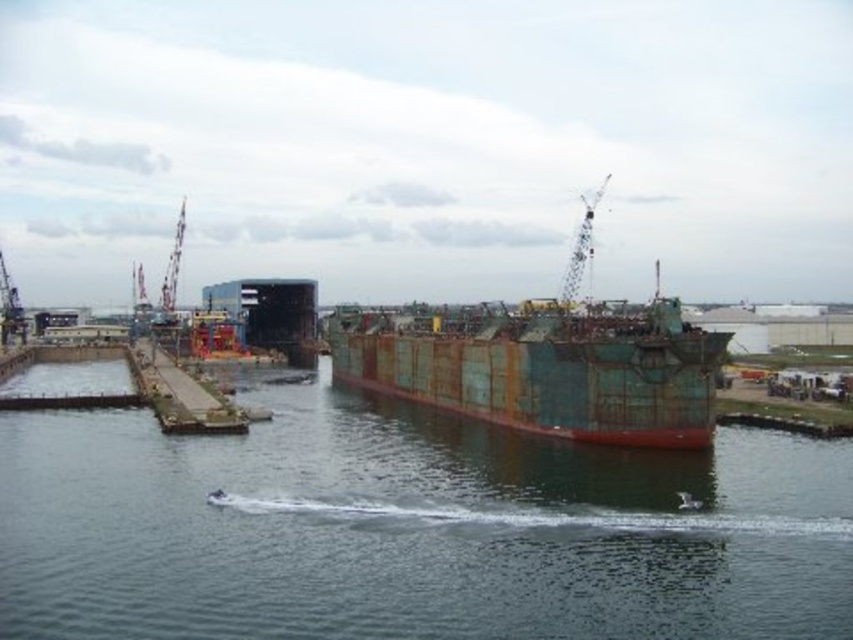
Question: Among these points, which one is nearest to the camera?

Choices:
 (A) (589, 228)
 (B) (483, 419)
 (C) (494, 577)

Answer: (C)

Question: Which object is closer to the camera taking this photo?

Choices:
 (A) rusty metal crane at upper left
 (B) rustic concrete dock at center
 (C) metallic wireframe crane at upper center
 (D) rusty metal cargo ship at center

Answer: (D)

Question: Does rusty metal waterway at center have a lesser width compared to rustic concrete dock at center?

Choices:
 (A) yes
 (B) no

Answer: (B)

Question: Does rusty metal waterway at center appear on the right side of rustic concrete dock at center?

Choices:
 (A) yes
 (B) no

Answer: (A)

Question: Which object is closer to the camera taking this photo?

Choices:
 (A) metallic wireframe crane at upper center
 (B) rusty metal cargo ship at center
 (C) rustic concrete dock at center
 (D) rusty metal waterway at center

Answer: (D)

Question: Does rusty metal waterway at center appear over rusty metal crane at upper left?

Choices:
 (A) no
 (B) yes

Answer: (A)